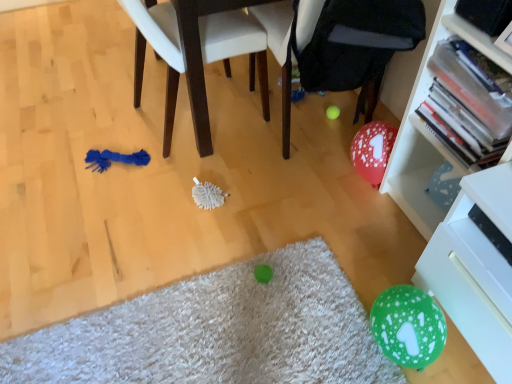
Image resolution: width=512 pixels, height=384 pixels. What are the coordinates of `vacant area in front of black fabric bean bag chair at center` in the screenshot? It's located at (295, 200).